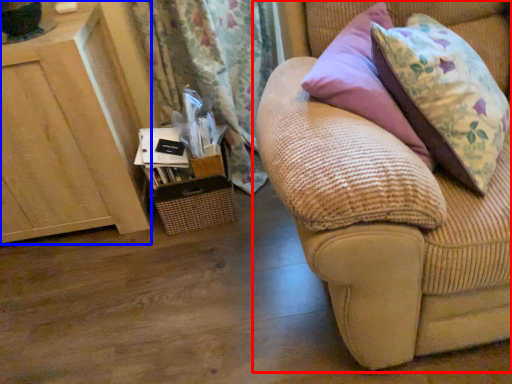
Question: Among these objects, which one is farthest to the camera, studio couch (highlighted by a red box) or furniture (highlighted by a blue box)?

Choices:
 (A) studio couch
 (B) furniture

Answer: (B)